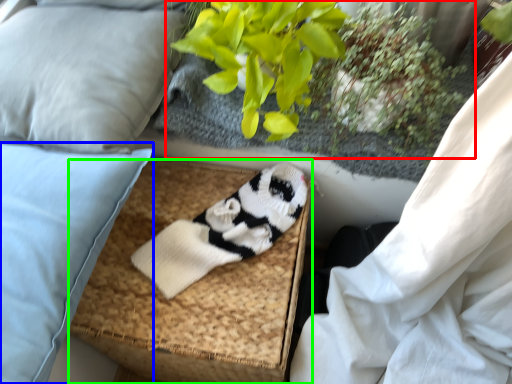
Question: Which object is positioned closest to floral arrangement (highlighted by a red box)? Select from pillow (highlighted by a blue box) and footrest (highlighted by a green box).

Choices:
 (A) pillow
 (B) footrest

Answer: (B)